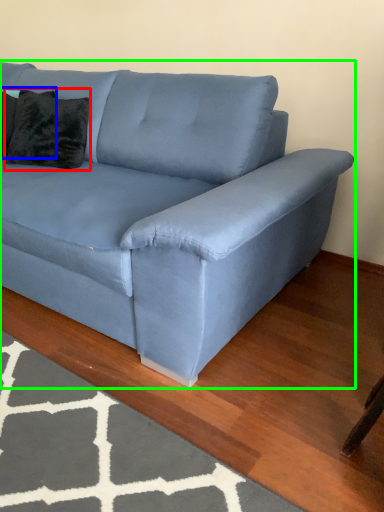
Question: Which is farther away from pillow (highlighted by a red box)? pillow (highlighted by a blue box) or studio couch (highlighted by a green box)?

Choices:
 (A) pillow
 (B) studio couch

Answer: (B)